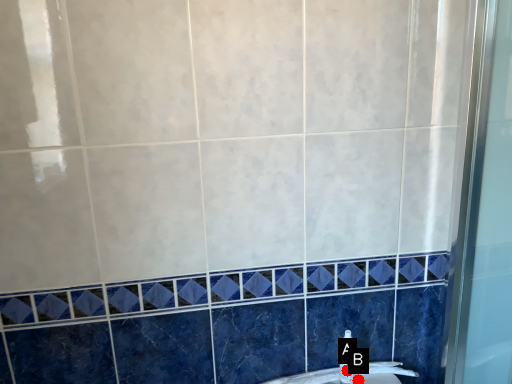
Question: Two points are circled on the image, labeled by A and B beside each circle. Which point is closer to the camera?

Choices:
 (A) A is closer
 (B) B is closer

Answer: (A)